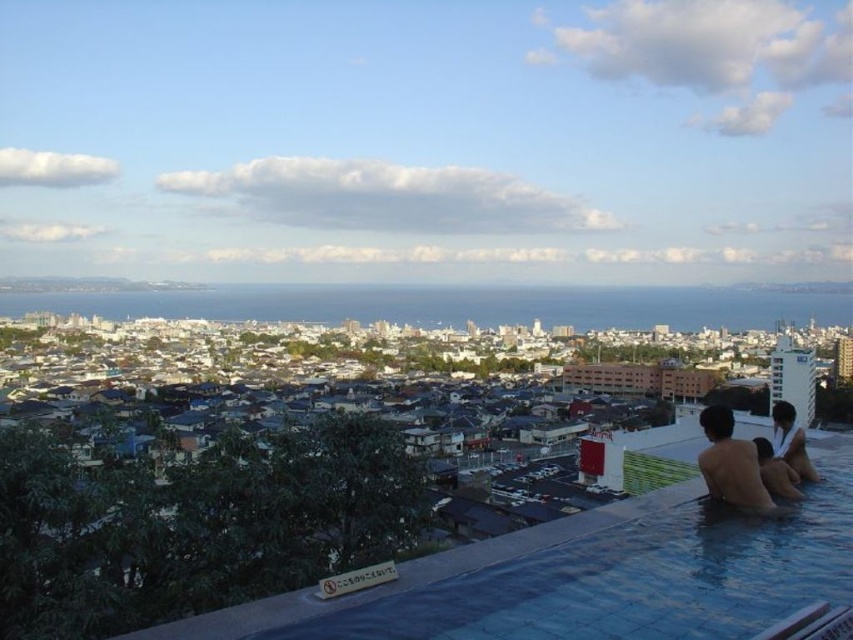
Question: Among these points, which one is nearest to the camera?

Choices:
 (A) (746, 506)
 (B) (804, 465)

Answer: (A)

Question: Does skinny man at lower right appear under smooth skin man at lower right?

Choices:
 (A) no
 (B) yes

Answer: (B)

Question: Is skinny man at lower right bigger than smooth skin man at lower right?

Choices:
 (A) no
 (B) yes

Answer: (A)

Question: Among these points, which one is farthest from the camera?

Choices:
 (A) (729, 436)
 (B) (796, 456)

Answer: (A)

Question: Observing the image, what is the correct spatial positioning of skinny man at lower right in reference to smooth skin man at lower right?

Choices:
 (A) below
 (B) above

Answer: (A)